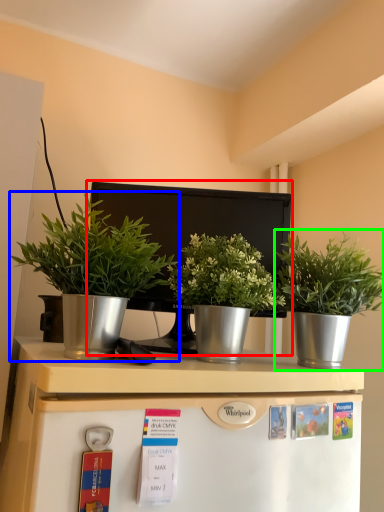
Question: Which object is positioned closest to appliance (highlighted by a red box)? Select from houseplant (highlighted by a blue box) and houseplant (highlighted by a green box).

Choices:
 (A) houseplant
 (B) houseplant

Answer: (A)